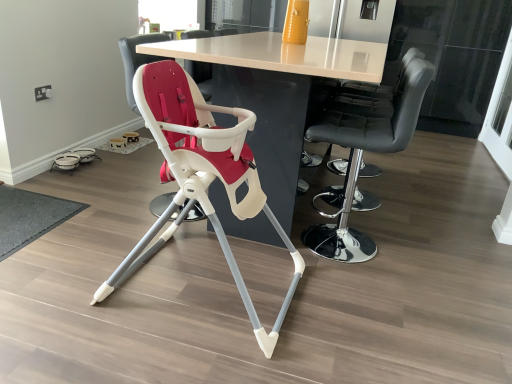
The height and width of the screenshot is (384, 512). What are the coordinates of `free location to the left of white plastic highchair at center, arranged as the 3th chair when viewed from the right` in the screenshot? It's located at (110, 198).